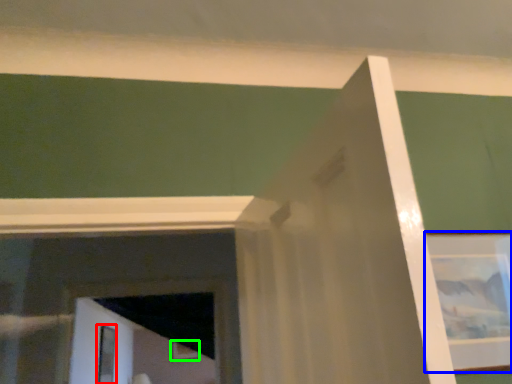
Question: Based on their relative distances, which object is farther from screen door (highlighted by a red box)? Choose from picture frame (highlighted by a blue box) and picture frame (highlighted by a green box).

Choices:
 (A) picture frame
 (B) picture frame

Answer: (A)